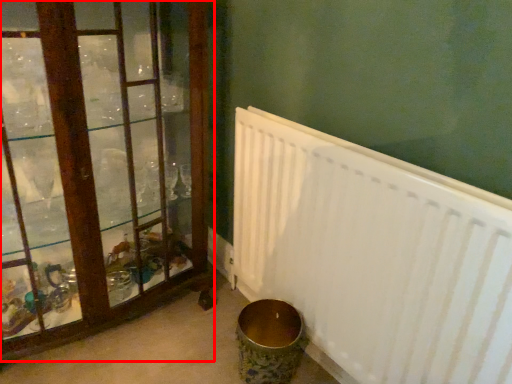
Question: From the image's perspective, what is the correct spatial positioning of window (annotated by the red box) in reference to radiator?

Choices:
 (A) above
 (B) below

Answer: (A)